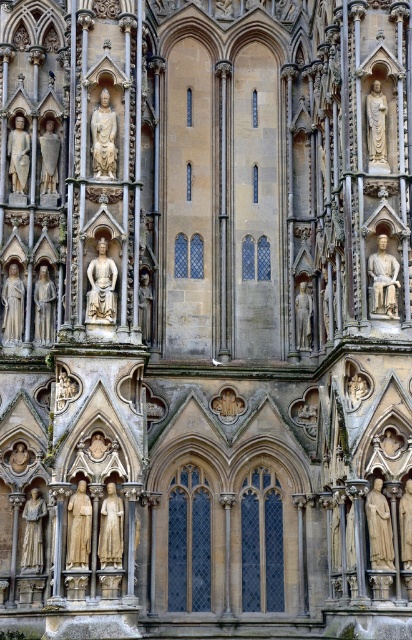
Question: Is golden stone statue at center left smaller than polished stone statue at center?

Choices:
 (A) yes
 (B) no

Answer: (B)

Question: Estimate the real-world distances between objects in this image. Which object is closer to the smooth stone statue at center?

Choices:
 (A) beige stone statue at center
 (B) stone statue at upper left

Answer: (A)

Question: From the image, what is the correct spatial relationship of stone statue at upper left in relation to golden stone statue at lower left?

Choices:
 (A) left
 (B) right

Answer: (B)

Question: Is beige stone statue at center closer to camera compared to golden stone statue at lower left?

Choices:
 (A) no
 (B) yes

Answer: (B)

Question: Which is farther from the polished stone statue at center?

Choices:
 (A) matte stone statue at center left
 (B) polished stone statue at right
 (C) stone statue at upper left

Answer: (C)

Question: Based on their relative distances, which object is farther from the golden stone statue at center left?

Choices:
 (A) smooth stone statue at center
 (B) polished stone statue at right
 (C) polished stone statue at center
 (D) matte stone statue at center left

Answer: (A)